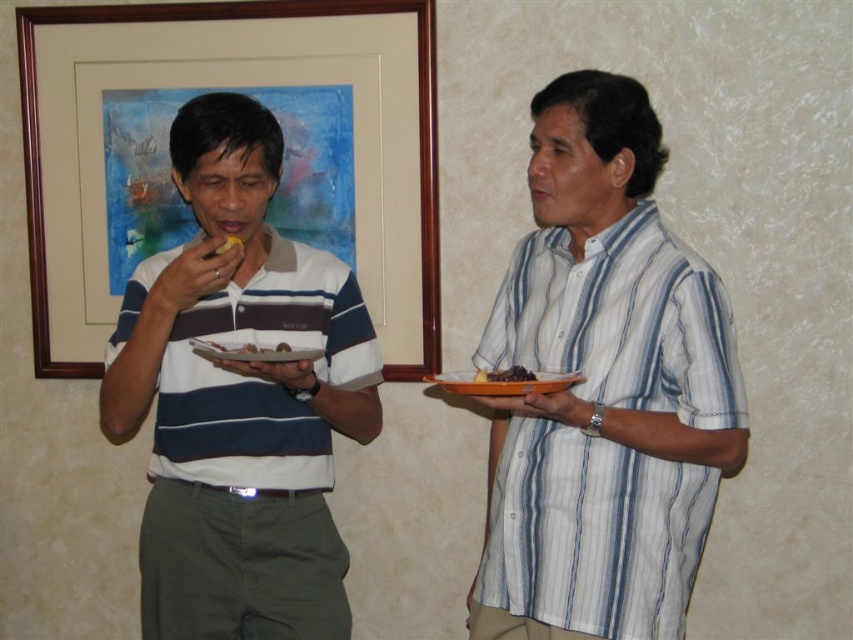
Question: Does white striped shirt at left appear on the left side of orange matte platter at right?

Choices:
 (A) yes
 (B) no

Answer: (A)

Question: Which point is closer to the camera taking this photo?

Choices:
 (A) (345, 342)
 (B) (531, 374)
 (C) (444, 374)
 (D) (200, 352)

Answer: (B)

Question: Which object is positioned closest to the white striped shirt at center?

Choices:
 (A) white matte plate at center
 (B) white striped shirt at right

Answer: (A)

Question: Does wooden frame at upper left appear under yellow matte food at center?

Choices:
 (A) no
 (B) yes

Answer: (A)

Question: Can you confirm if white striped shirt at right is positioned to the left of wooden frame at upper left?

Choices:
 (A) yes
 (B) no

Answer: (B)

Question: Which object is closer to the camera taking this photo?

Choices:
 (A) yellow matte food at center
 (B) white matte plate at center
 (C) orange matte platter at right

Answer: (C)